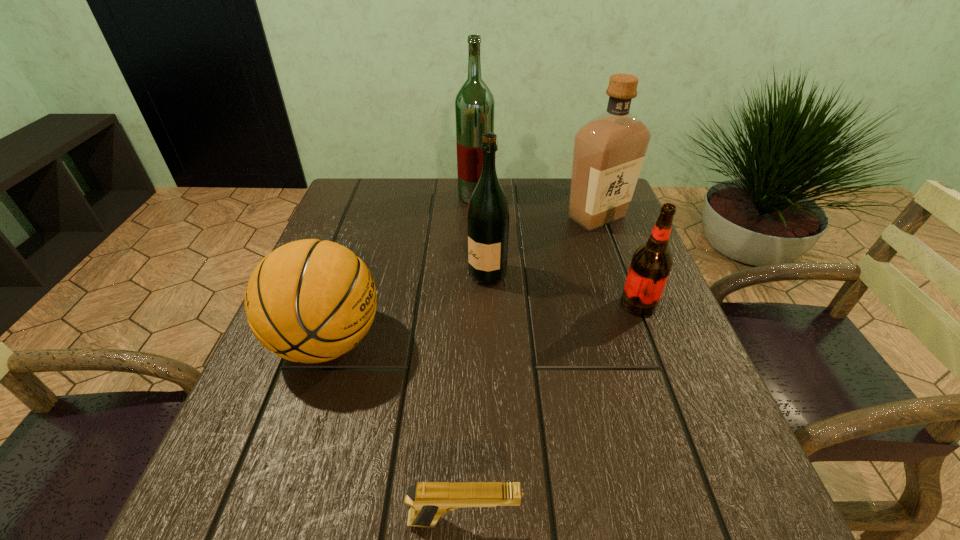
The height and width of the screenshot is (540, 960). Find the location of `object that is the fourth nearest to the shortest object`. object that is the fourth nearest to the shortest object is located at coordinates (609, 150).

Identify which object is the third nearest to the root beer. Please provide its 2D coordinates. Your answer should be formatted as a tuple, i.e. [(x, y)], where the tuple contains the x and y coordinates of a point satisfying the conditions above.

[(474, 106)]

This screenshot has height=540, width=960. I want to click on the closest liquor relative to the third farthest object, so click(609, 150).

Where is `liquor that is the closest to the shortest object`? Image resolution: width=960 pixels, height=540 pixels. liquor that is the closest to the shortest object is located at coordinates (488, 214).

Identify the location of vacant space that satisfies the following two spatial constraints: 1. on the front-facing side of the rightmost liquor; 2. on the front-facing side of the nearest liquor. This screenshot has width=960, height=540. (618, 275).

Locate an element on the screen. free space in the image that satisfies the following two spatial constraints: 1. on the front-facing side of the rightmost liquor; 2. on the front-facing side of the third farthest object is located at coordinates (618, 275).

Identify the location of free spot that satisfies the following two spatial constraints: 1. on the front-facing side of the rightmost liquor; 2. at the barrel of the nearest object. (707, 521).